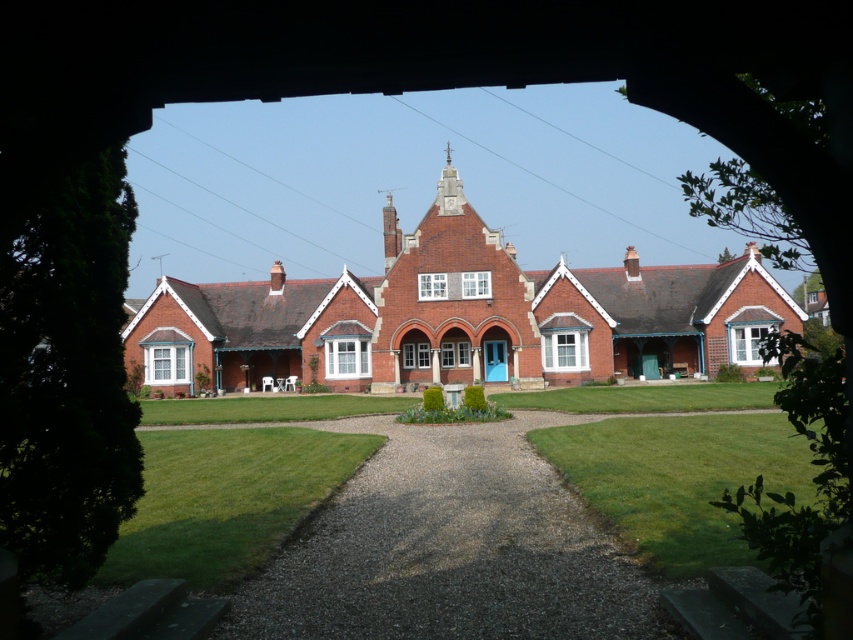
You are standing at the gravel path leading to the red brick building and want to walk to the green grass at lower center and green grass at lower left. Which area of green grass has a wider path to walk on?

The green grass at lower center has a wider path to walk on because its width surpasses that of the green grass at lower left.

You are standing at the gravel path leading to the red brick building and see the green grass at lower center and the green grass at lower left. Which patch of grass is on the right side when facing the building?

The green grass at lower center is positioned on the right side of green grass at lower left, so when facing the building, the green grass at lower center is on the right side.